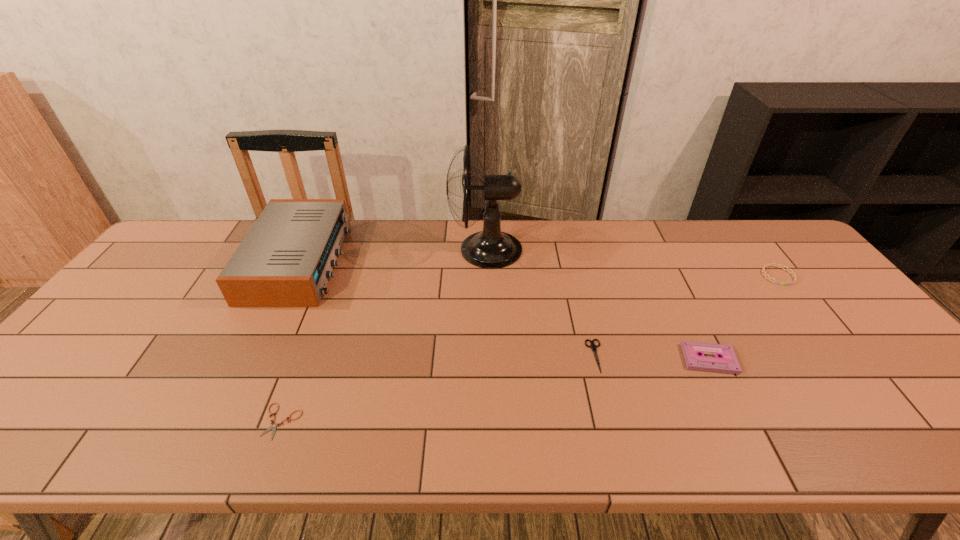
Identify the location of vacant space located 0.220m on the front-facing side of the tallest object. (382, 249).

Identify the location of vacant space located 0.190m on the front-facing side of the tallest object. The width and height of the screenshot is (960, 540). (392, 249).

Image resolution: width=960 pixels, height=540 pixels. I want to click on free space located 0.370m on the front panel of the second tallest object, so click(461, 261).

This screenshot has height=540, width=960. I want to click on free location located 0.170m on the surface of the rightmost object showing star-shaped elements, so click(x=820, y=329).

Where is `vacant area located 0.190m on the right of the videotape`? vacant area located 0.190m on the right of the videotape is located at coordinates (812, 359).

The width and height of the screenshot is (960, 540). I want to click on free location located on the back of the farther shears, so click(584, 307).

Identify the location of free space located 0.060m on the right of the nearer shears. Image resolution: width=960 pixels, height=540 pixels. (327, 422).

Locate an element on the screen. The image size is (960, 540). fan that is at the far edge is located at coordinates (491, 248).

This screenshot has height=540, width=960. Find the location of `radio receiver positioned at the far edge`. radio receiver positioned at the far edge is located at coordinates (285, 260).

You are a GUI agent. You are given a task and a screenshot of the screen. Output one action in this format:
    pyautogui.click(x=<x>, y=<y>)
    Task: Click on the object located at the near edge
    
    Given the screenshot: What is the action you would take?
    274,426